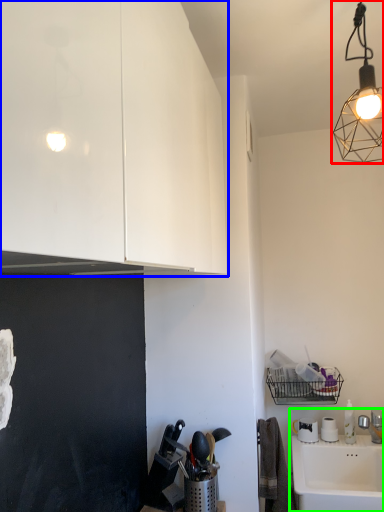
Question: Which object is the farthest from lamp (highlighted by a red box)? Choose among these: cabinetry (highlighted by a blue box) or sink (highlighted by a green box).

Choices:
 (A) cabinetry
 (B) sink

Answer: (B)